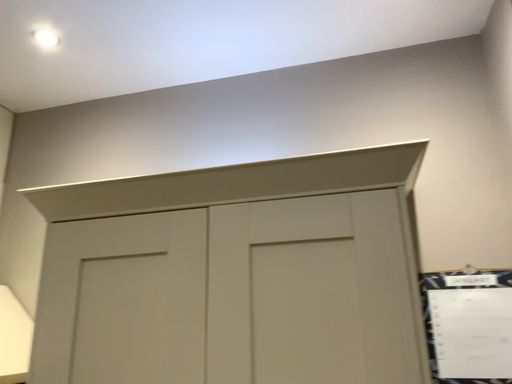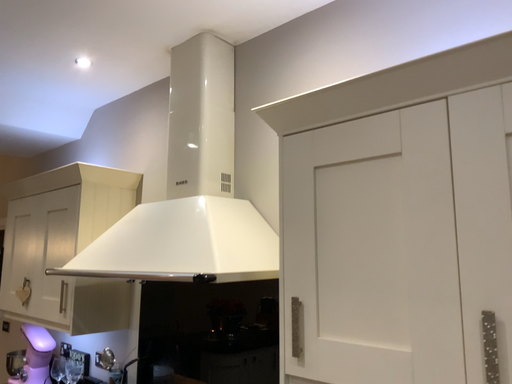
Question: How did the camera likely rotate when shooting the video?

Choices:
 (A) rotated right
 (B) rotated left

Answer: (B)